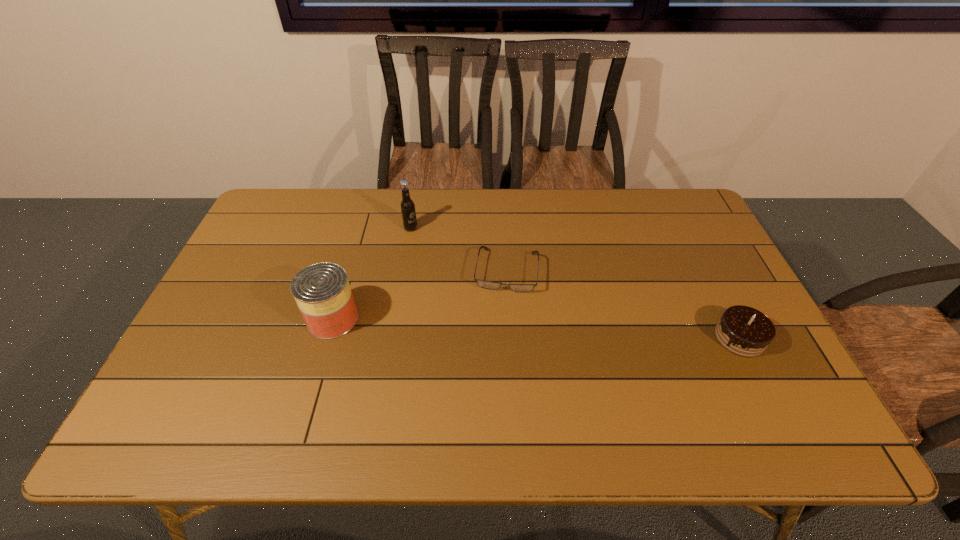
Image resolution: width=960 pixels, height=540 pixels. Identify the location of vacant point at the right edge. (676, 251).

Find the location of a particular element. The image size is (960, 540). vacant region at the far left corner is located at coordinates (260, 233).

Locate an element on the screen. The height and width of the screenshot is (540, 960). free region at the near left corner of the desktop is located at coordinates (214, 400).

In the image, there is a desktop. Where is `vacant space at the far right corner`? The image size is (960, 540). vacant space at the far right corner is located at coordinates (707, 232).

Locate an element on the screen. This screenshot has width=960, height=540. unoccupied area between the root beer and the spectacles is located at coordinates (459, 249).

This screenshot has width=960, height=540. Find the location of `vacant space in between the third tallest object and the can`. vacant space in between the third tallest object and the can is located at coordinates (536, 328).

What are the coordinates of `blank region between the second shortest object and the root beer` in the screenshot? It's located at (575, 283).

This screenshot has height=540, width=960. Find the location of `vacant region between the third tallest object and the third object from right to left`. vacant region between the third tallest object and the third object from right to left is located at coordinates (575, 283).

Locate an element on the screen. vacant area that lies between the third tallest object and the spectacles is located at coordinates (623, 304).

At what (x,y) coordinates should I click in order to perform the action: click on unoccupied area between the second shortest object and the spectacles. Please return your answer as a coordinate pair (x, y). This screenshot has width=960, height=540. Looking at the image, I should click on (623, 304).